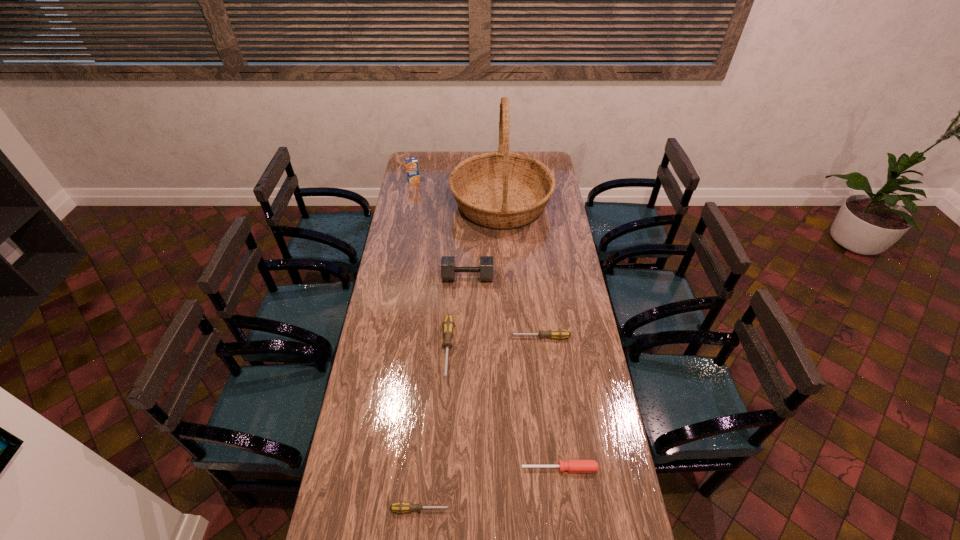
You are a GUI agent. You are given a task and a screenshot of the screen. Output one action in this format:
    pyautogui.click(x=<x>, y=<y>)
    Task: Click on the red screwdriver
    
    Given the screenshot: What is the action you would take?
    (573, 466)

Find the location of a particular element. The width and height of the screenshot is (960, 540). the nearest gray screwdriver is located at coordinates (400, 507).

Find the location of `the nearest screwdriver`. the nearest screwdriver is located at coordinates (400, 507).

The height and width of the screenshot is (540, 960). Find the location of `vacant area located 0.240m on the front of the tallest object`. vacant area located 0.240m on the front of the tallest object is located at coordinates (505, 274).

You are a GUI agent. You are given a task and a screenshot of the screen. Output one action in this format:
    pyautogui.click(x=<x>, y=<y>)
    Task: Click on the vacant point located 0.120m on the back of the leftmost object
    This screenshot has width=960, height=540.
    Given the screenshot: What is the action you would take?
    pos(417,167)

Where is `free space located 0.400m on the front of the dumbbell`? This screenshot has width=960, height=540. free space located 0.400m on the front of the dumbbell is located at coordinates (466, 364).

What are the coordinates of `vacant region located 0.130m at the tip of the fourth shortest object` in the screenshot? It's located at (444, 417).

Where is `vacant space situated 0.120m at the tip of the third shortest object`? Image resolution: width=960 pixels, height=540 pixels. vacant space situated 0.120m at the tip of the third shortest object is located at coordinates (479, 338).

You are a GUI agent. You are given a task and a screenshot of the screen. Output one action in this format:
    pyautogui.click(x=<x>, y=<y>)
    Task: Click on the vacant area situated 0.380m at the tip of the third shortest object
    
    Given the screenshot: What is the action you would take?
    pyautogui.click(x=414, y=338)

You are a GUI agent. You are given a task and a screenshot of the screen. Output one action in this format:
    pyautogui.click(x=<x>, y=<y>)
    Task: Click on the free space located at the tip of the third shortest object
    
    Given the screenshot: What is the action you would take?
    pyautogui.click(x=494, y=338)